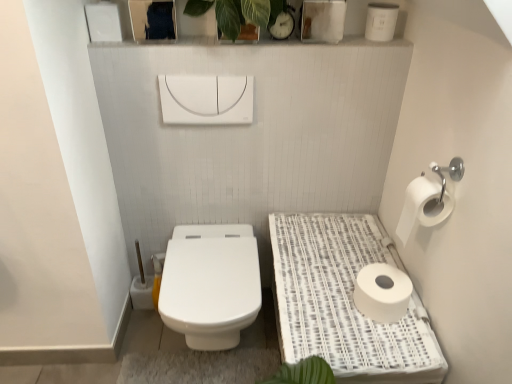
Question: From a real-world perspective, is white woven tray at right below white matte toilet paper at lower right, acting as the first toilet paper starting from the bottom?

Choices:
 (A) no
 (B) yes

Answer: (B)

Question: Would you say white woven tray at right is outside white matte toilet paper at lower right, placed as the 2th toilet paper when sorted from top to bottom?

Choices:
 (A) no
 (B) yes

Answer: (B)

Question: Considering the relative sizes of white woven tray at right and white matte toilet paper at lower right, placed as the 2th toilet paper when sorted from top to bottom, in the image provided, is white woven tray at right bigger than white matte toilet paper at lower right, placed as the 2th toilet paper when sorted from top to bottom,?

Choices:
 (A) yes
 (B) no

Answer: (A)

Question: Can you confirm if white woven tray at right is shorter than white matte toilet paper at lower right, acting as the first toilet paper starting from the bottom?

Choices:
 (A) yes
 (B) no

Answer: (B)

Question: Does white woven tray at right appear on the left side of white matte toilet paper at lower right, acting as the first toilet paper starting from the bottom?

Choices:
 (A) yes
 (B) no

Answer: (A)

Question: Is white matte toilet paper at lower right, placed as the 2th toilet paper when sorted from top to bottom, a part of white woven tray at right?

Choices:
 (A) yes
 (B) no

Answer: (A)

Question: Does white glossy toilet at center have a lesser height compared to green leafy plant at upper center?

Choices:
 (A) yes
 (B) no

Answer: (B)

Question: Considering the relative sizes of white glossy toilet at center and green leafy plant at upper center in the image provided, is white glossy toilet at center bigger than green leafy plant at upper center?

Choices:
 (A) no
 (B) yes

Answer: (B)

Question: Is white glossy toilet at center facing towards green leafy plant at upper center?

Choices:
 (A) yes
 (B) no

Answer: (B)

Question: Is white glossy toilet at center to the left of green leafy plant at upper center from the viewer's perspective?

Choices:
 (A) yes
 (B) no

Answer: (A)

Question: From a real-world perspective, is white glossy toilet at center physically above green leafy plant at upper center?

Choices:
 (A) no
 (B) yes

Answer: (A)

Question: From the image's perspective, is white glossy toilet at center over green leafy plant at upper center?

Choices:
 (A) yes
 (B) no

Answer: (B)

Question: From a real-world perspective, is white matte toilet paper at right, which is the 2th toilet paper in bottom-to-top order, below white matte toilet paper at lower right, acting as the first toilet paper starting from the bottom?

Choices:
 (A) no
 (B) yes

Answer: (A)